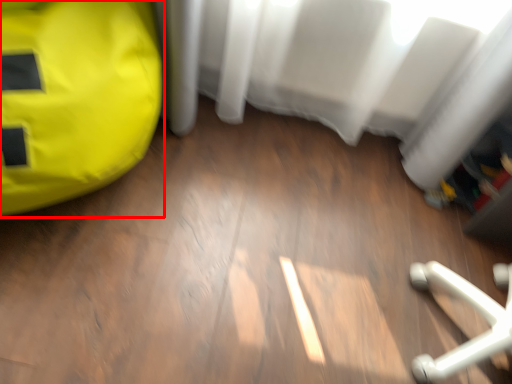
Question: Observing the image, what is the correct spatial positioning of bean bag chair (annotated by the red box) in reference to curtain?

Choices:
 (A) right
 (B) left

Answer: (B)